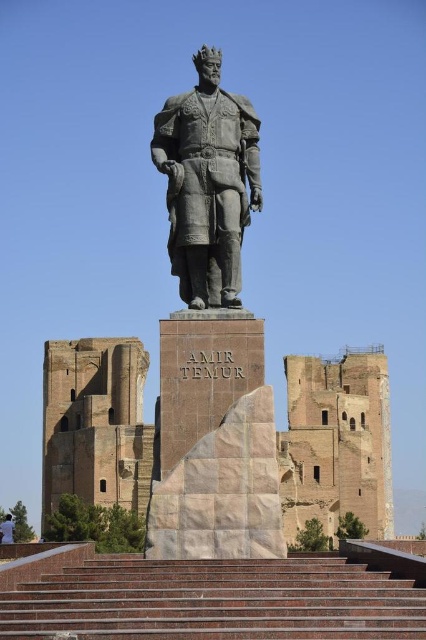
You are a tourist standing at the bottom of the brown stone stairs at center. You want to take a photo of the statue of Amir Temur. To do this, you need to climb the stairs. However, there is a person wearing a white cotton shirt at lower left sitting on the stairs. Can you climb the stairs to take the photo?

The brown stone stairs at center is positioned over the white cotton shirt at lower left, meaning the person sitting on the stairs is blocking access to the stairs. You cannot climb the stairs to take the photo without disturbing them.

You are a tourist visiting the statue of Amir Temur. You see the brown stone stairs at center and the white cotton shirt at lower left. Which object is narrower?

The brown stone stairs at center is thinner than the white cotton shirt at lower left, so the brown stone stairs at center is narrower.

You are a photographer planning to take a photo of the bronze statue at center and the white cotton shirt at lower left. Based on their sizes in the image, which object would appear smaller in the final photo?

The bronze statue at center appears smaller in the photo because it has a lesser height compared to the white cotton shirt at lower left.